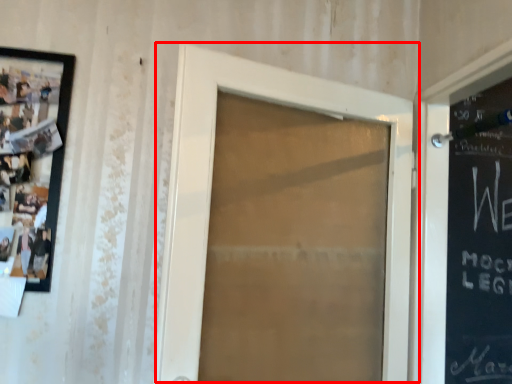
Question: From the image's perspective, where is door (annotated by the red box) located relative to picture frame?

Choices:
 (A) below
 (B) above

Answer: (A)